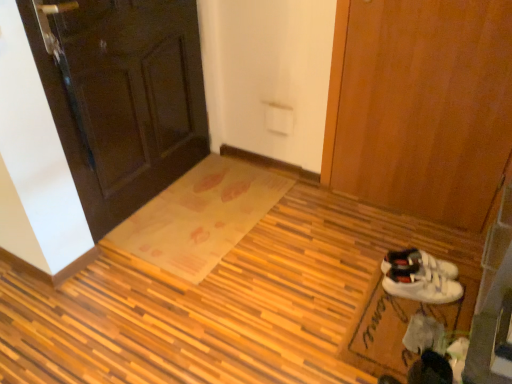
Question: Considering the positions of translucent plastic doormat at center, placed as the second doormat when sorted from right to left, and dark wood door at upper left, the 1th door from the left, in the image, is translucent plastic doormat at center, placed as the second doormat when sorted from right to left, taller or shorter than dark wood door at upper left, the 1th door from the left,?

Choices:
 (A) short
 (B) tall

Answer: (A)

Question: In terms of size, does translucent plastic doormat at center, the 1th doormat when ordered from left to right, appear bigger or smaller than dark wood door at upper left, the 1th door from the left?

Choices:
 (A) small
 (B) big

Answer: (A)

Question: Which is nearer to the dark wood door at upper left, the 1th door from the left?

Choices:
 (A) wooden door at right, the 2th door positioned from the left
 (B) translucent plastic doormat at center, placed as the second doormat when sorted from right to left
 (C) wooden mat at center
 (D) white suede sneakers at lower right
 (E) white fabric doormat at lower right, which is the first doormat in right-to-left order

Answer: (B)

Question: Considering the real-world distances, which object is closest to the white suede sneakers at lower right?

Choices:
 (A) translucent plastic doormat at center, the 2th doormat in the front-to-back sequence
 (B) dark wood door at upper left, placed as the second door when sorted from right to left
 (C) wooden mat at center
 (D) wooden door at right, marked as the first door in a right-to-left arrangement
 (E) white fabric doormat at lower right, arranged as the 2th doormat when viewed from the left

Answer: (E)